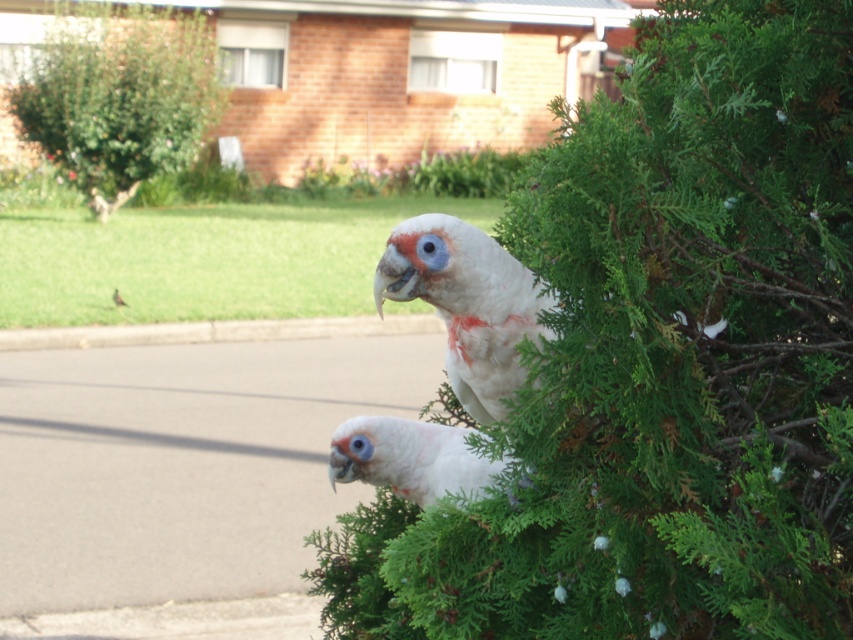
Question: Estimate the real-world distances between objects in this image. Which object is farther from the green leafy bush at upper right?

Choices:
 (A) white feathered parrot at center
 (B) white feathered bird at upper center
 (C) green leafy bush at upper left
 (D) white matte parrot at center

Answer: (C)

Question: Is green leafy bush at upper right below green leafy bush at upper left?

Choices:
 (A) yes
 (B) no

Answer: (A)

Question: Considering the real-world distances, which object is farthest from the white feathered bird at upper center?

Choices:
 (A) white matte parrot at center
 (B) white feathered parrot at center
 (C) green leafy bush at upper right

Answer: (C)

Question: Which point appears farthest from the camera in this image?

Choices:
 (A) (42, 131)
 (B) (120, 305)
 (C) (521, 376)
 (D) (616, 248)

Answer: (A)

Question: Does green leafy bush at upper right appear under white matte parrot at center?

Choices:
 (A) yes
 (B) no

Answer: (B)

Question: Can you confirm if white matte parrot at center is positioned to the left of white feathered parrot at center?

Choices:
 (A) yes
 (B) no

Answer: (B)